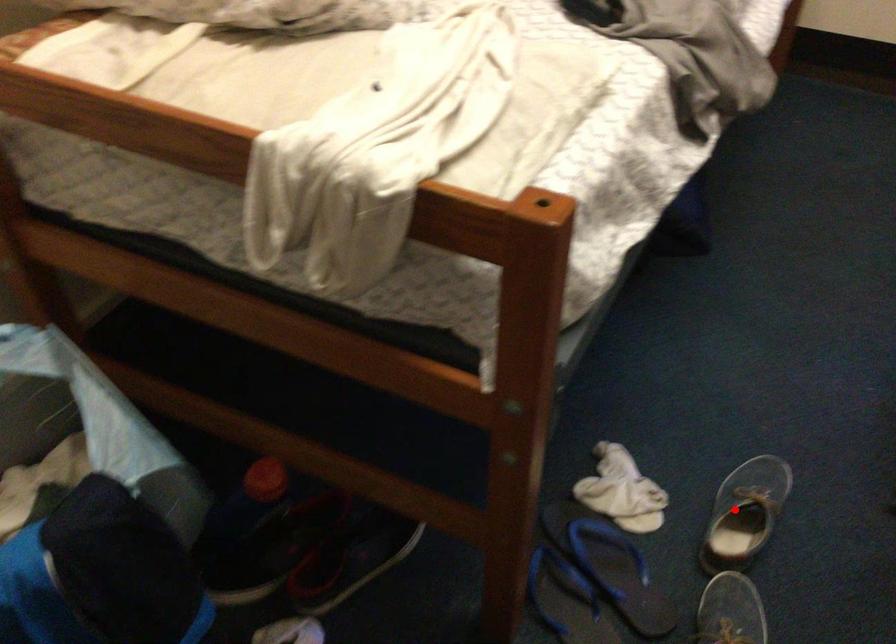
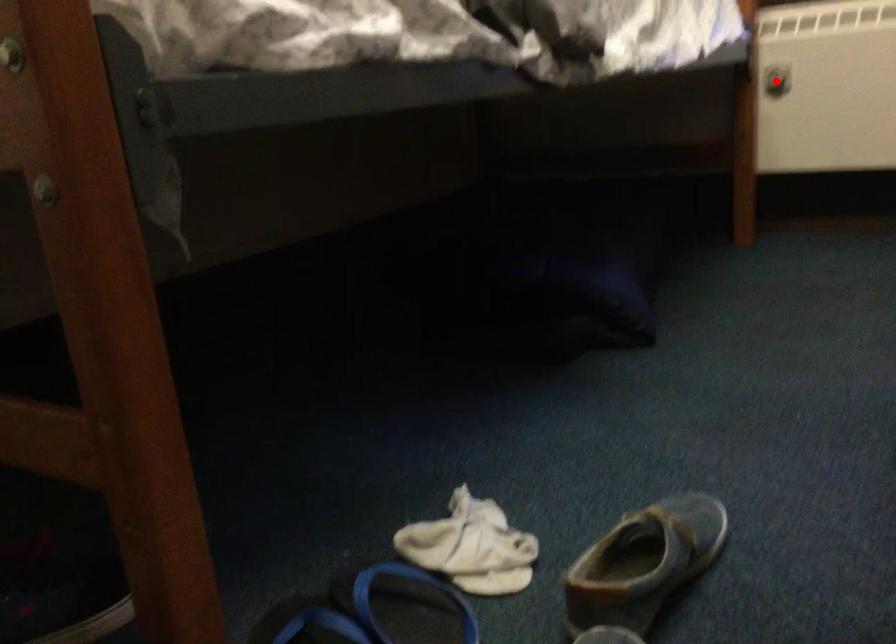
In the scene shown: I am providing you with two images of the same scene from different viewpoints. A red point is marked on the first image and another point is marked on the second image. Are the points marked in image1 and image2 representing the same 3D position?

No